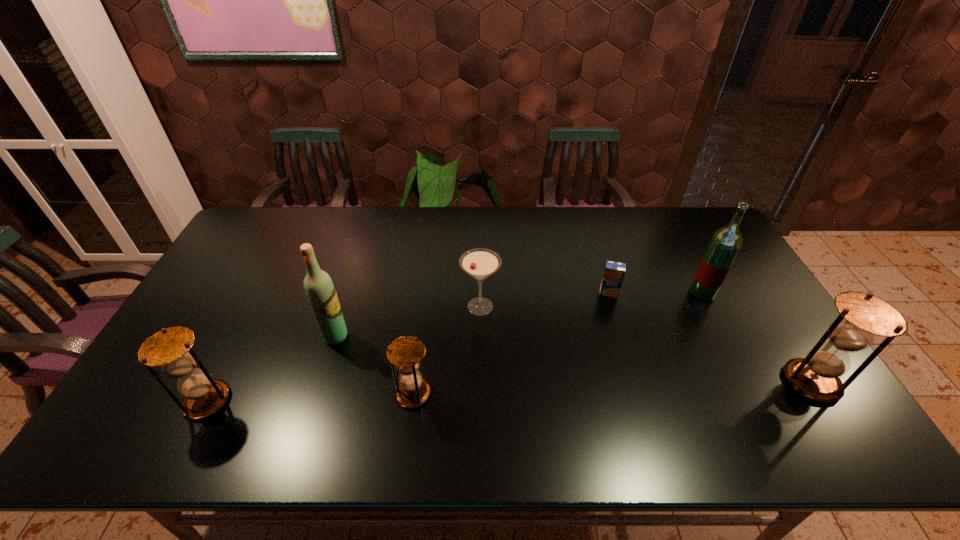
Identify the location of the second shortest hourglass. Image resolution: width=960 pixels, height=540 pixels. (170, 348).

The image size is (960, 540). I want to click on the leftmost hourglass, so click(170, 348).

You are a GUI agent. You are given a task and a screenshot of the screen. Output one action in this format:
    pyautogui.click(x=<x>, y=<y>)
    Task: Click on the second hourglass from left to right
    This screenshot has width=960, height=540.
    Given the screenshot: What is the action you would take?
    pyautogui.click(x=405, y=353)

Find the location of a particular element. The width and height of the screenshot is (960, 540). the shortest hourglass is located at coordinates (405, 353).

Where is `the rightmost hourglass`? The image size is (960, 540). the rightmost hourglass is located at coordinates click(x=861, y=316).

The height and width of the screenshot is (540, 960). Find the location of `the third tallest object`. the third tallest object is located at coordinates (861, 316).

Identify the location of the fifth object from left to right. (614, 272).

Find the location of `orange_juice`. orange_juice is located at coordinates (614, 272).

At what (x,y) coordinates should I click in order to perform the action: click on the sixth object from right to left. Please return your answer as a coordinate pair (x, y). Looking at the image, I should click on (320, 290).

This screenshot has width=960, height=540. I want to click on the fourth nearest object, so click(x=320, y=290).